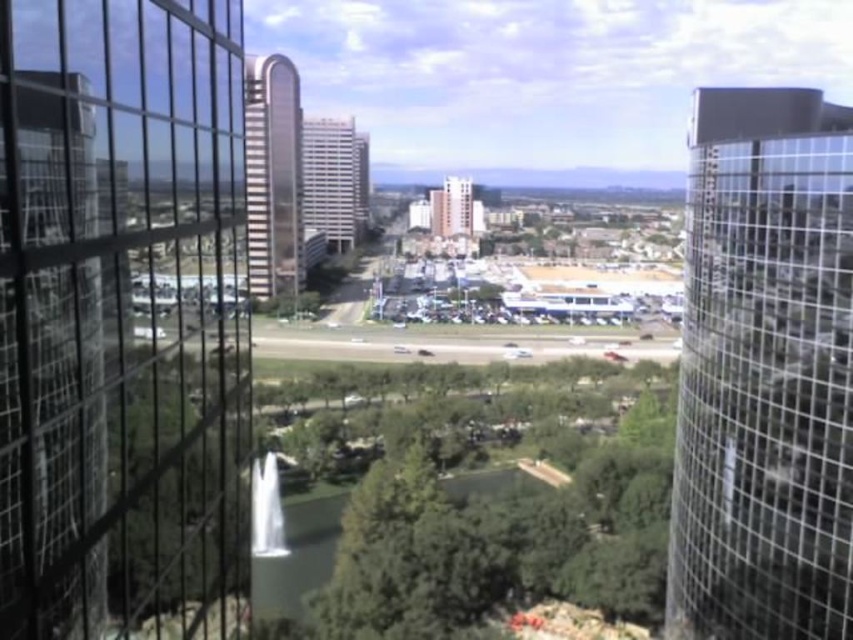
Question: Among these points, which one is farthest from the camera?

Choices:
 (A) click(457, 605)
 (B) click(265, 179)
 (C) click(450, 202)
 (D) click(157, 113)

Answer: (C)

Question: Is sleek silver tower at center wider than smooth glass building at center?

Choices:
 (A) no
 (B) yes

Answer: (B)

Question: Which object appears farthest from the camera in this image?

Choices:
 (A) white glass building at center
 (B) smooth glass building at center
 (C) sleek silver tower at center

Answer: (B)

Question: Can you confirm if transparent glass window at left is thinner than white glass building at center?

Choices:
 (A) no
 (B) yes

Answer: (B)

Question: Does white glass building at center appear under smooth glass building at center?

Choices:
 (A) yes
 (B) no

Answer: (A)

Question: Which of the following is the closest to the observer?

Choices:
 (A) transparent glass window at left
 (B) smooth glass building at center

Answer: (A)